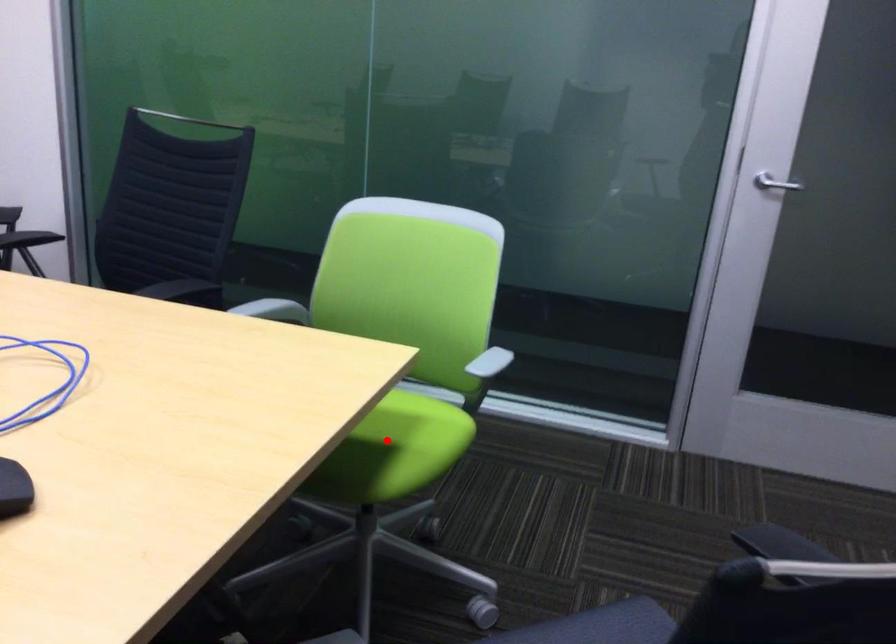
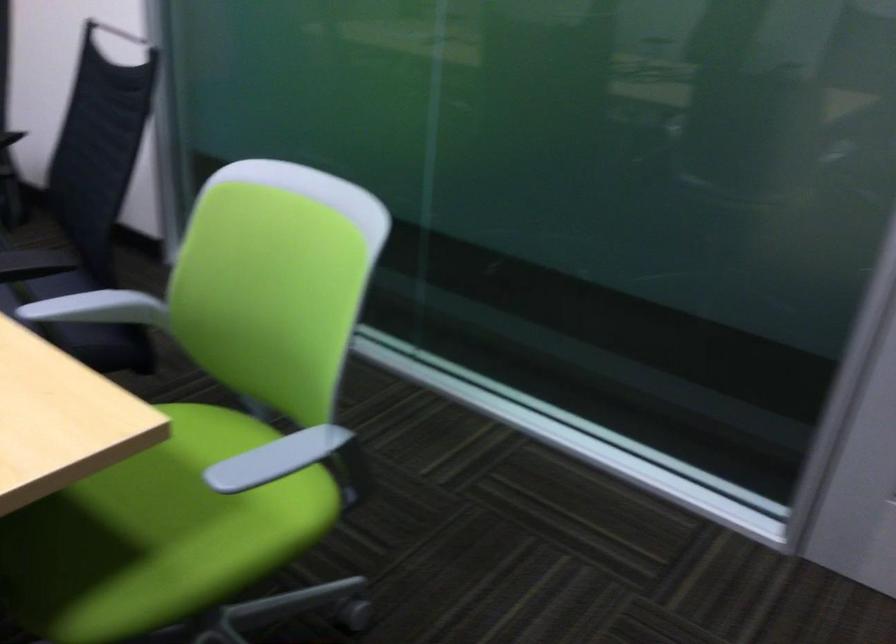
Locate, in the second image, the point that corresponds to the highlighted location in the first image.

(157, 534)